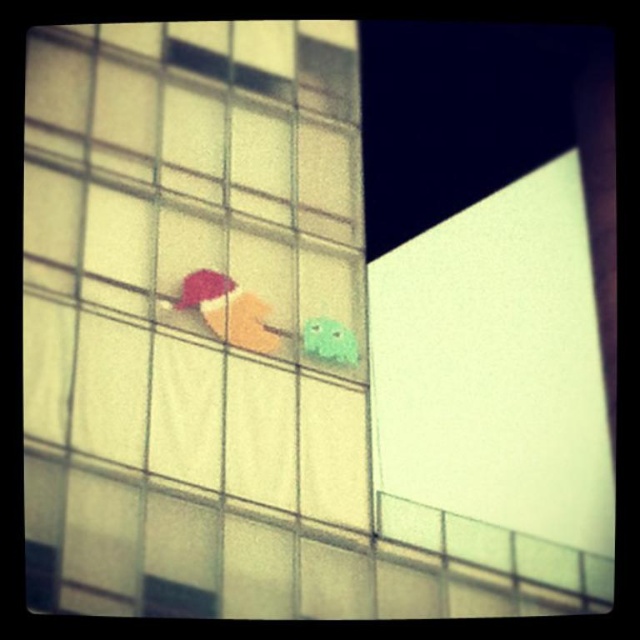
You are standing in front of a modern building with three colorful objects on its facade. You see a matte plastic ice cream cone at center and a green matte toy at center. Which object is located to the left of the other?

The matte plastic ice cream cone at center is positioned on the left side of green matte toy at center.

From the picture: You are standing in front of the modern building with three colorful objects attached to its facade. You notice the matte plastic ice cream cone at center and the green matte toy at center. Which of these two objects is placed higher up on the building?

The matte plastic ice cream cone at center is positioned over the green matte toy at center, so it is placed higher up on the building.